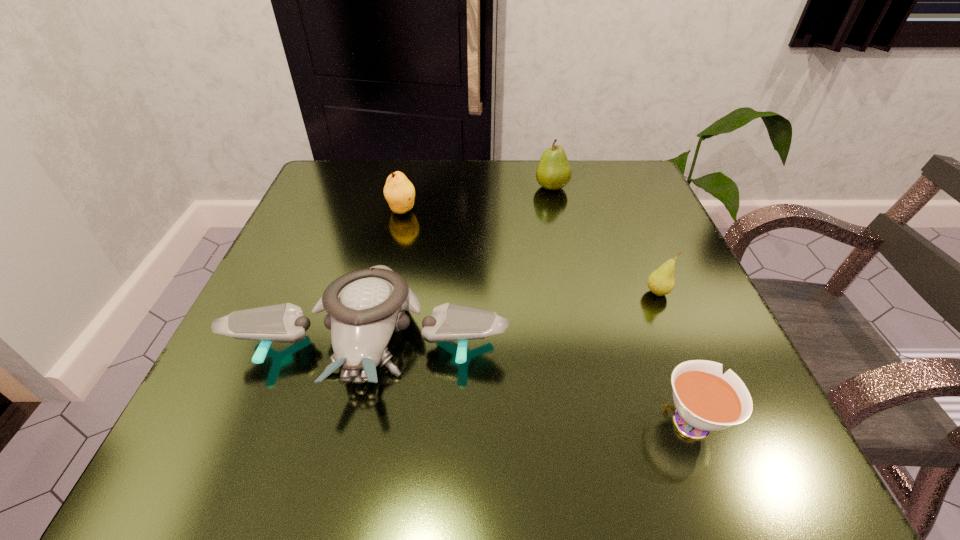
This screenshot has width=960, height=540. I want to click on vacant space that satisfies the following two spatial constraints: 1. on the side of the rightmost pear with the handle; 2. on the right side of the teacup, so click(x=641, y=293).

I want to click on free point that satisfies the following two spatial constraints: 1. on the back side of the tallest object; 2. on the right side of the leftmost pear, so click(407, 187).